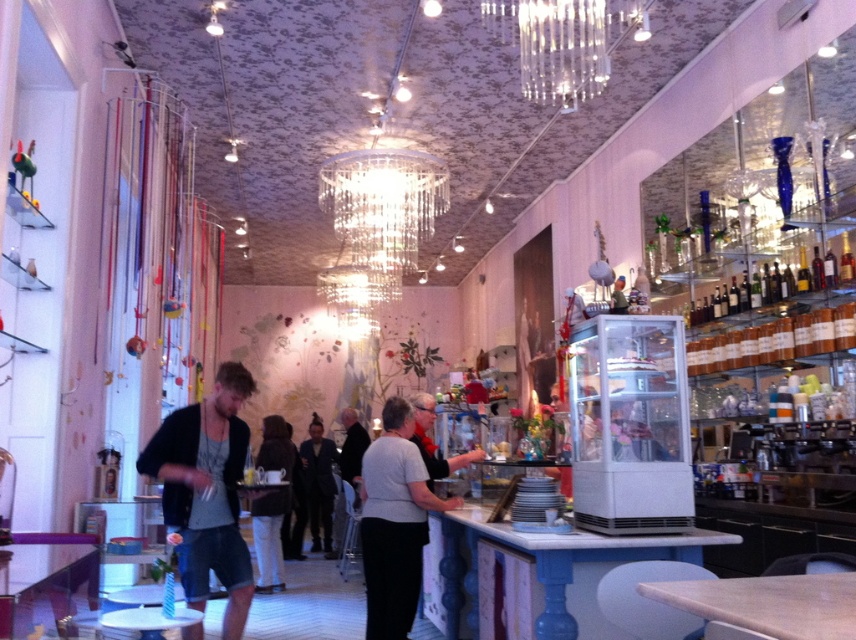
You are a customer at the cafe and want to choose between the dark brown leather jacket at center and the matte black shirt at center to wear for a casual evening out. Which item would you choose based on their sizes?

The dark brown leather jacket at center is larger in size than the matte black shirt at center, so it would be more suitable for a casual evening if you prefer a larger, more voluminous style.

You are a customer standing in the middle of the room. You want to hang a small picture frame on the wall above the black fabric jacket at center. Can you reach the clear crystal chandelier at upper center while doing this?

The clear crystal chandelier at upper center is much taller than the black fabric jacket at center, so you cannot reach the chandelier while hanging the frame above the jacket.